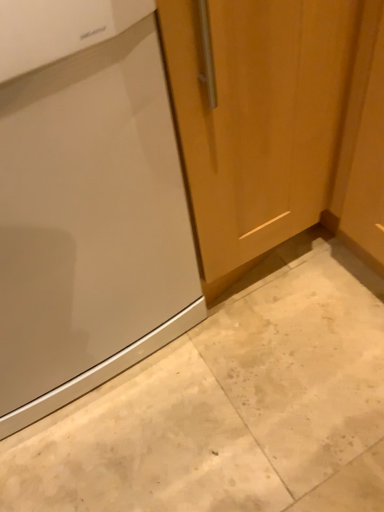
Question: From the image's perspective, is matte wood door at center positioned above or below satin finish refrigerator at left?

Choices:
 (A) below
 (B) above

Answer: (B)

Question: From a real-world perspective, is matte wood door at center physically located above or below satin finish refrigerator at left?

Choices:
 (A) above
 (B) below

Answer: (A)

Question: Which is nearer to the beige marble floor at lower left?

Choices:
 (A) matte wood door at center
 (B) satin finish refrigerator at left

Answer: (B)

Question: Estimate the real-world distances between objects in this image. Which object is farther from the satin finish refrigerator at left?

Choices:
 (A) matte wood door at center
 (B) beige marble floor at lower left

Answer: (B)